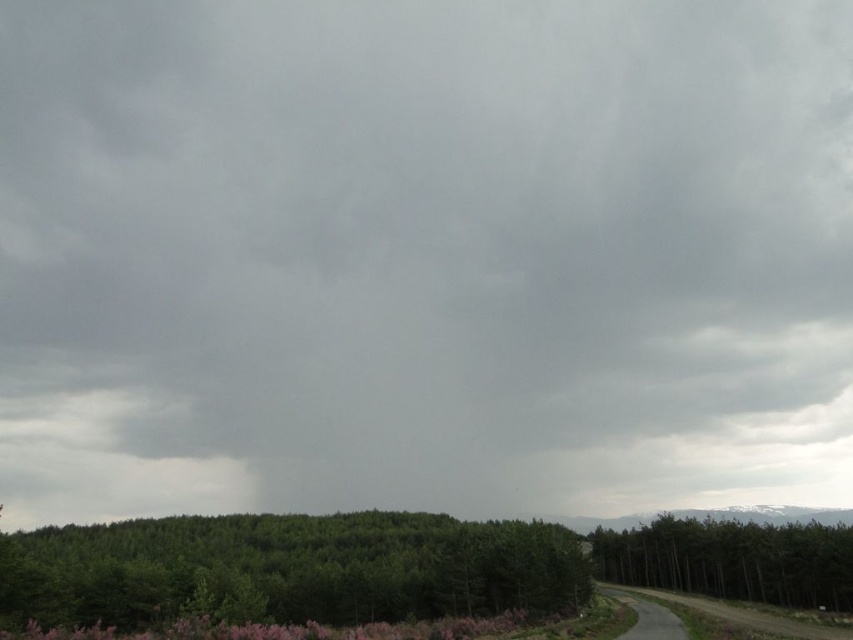
You are driving a car along the dirt road in the rural landscape. You see the green matte tree at lower center and the green matte tree at right. Which tree would you pass first as you drive along the road?

The green matte tree at lower center is to the left of the green matte tree at right, so you would pass the green matte tree at lower center first as you drive along the dirt road.

You are a hiker standing at the starting point of the dirt road in the image. You notice two green matte trees ahead. Which tree would appear closer to you, the green matte tree at lower center or the green matte tree at right?

The green matte tree at lower center appears closer because it is bigger than the green matte tree at right, and larger objects in the foreground typically seem nearer.